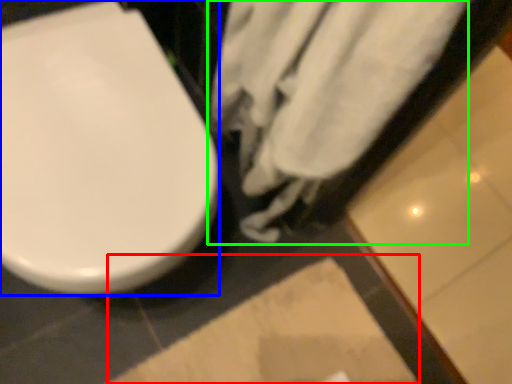
Question: Which object is positioned farthest from square (highlighted by a red box)? Select from toilet (highlighted by a blue box) and bath towel (highlighted by a green box).

Choices:
 (A) toilet
 (B) bath towel

Answer: (A)